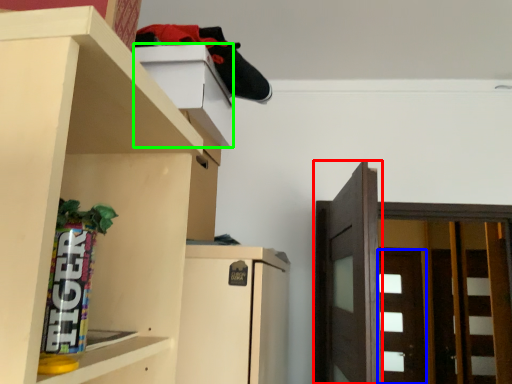
Question: Which object is the farthest from door (highlighted by a red box)? Choose among these: door (highlighted by a blue box) or cabinet (highlighted by a green box).

Choices:
 (A) door
 (B) cabinet

Answer: (A)